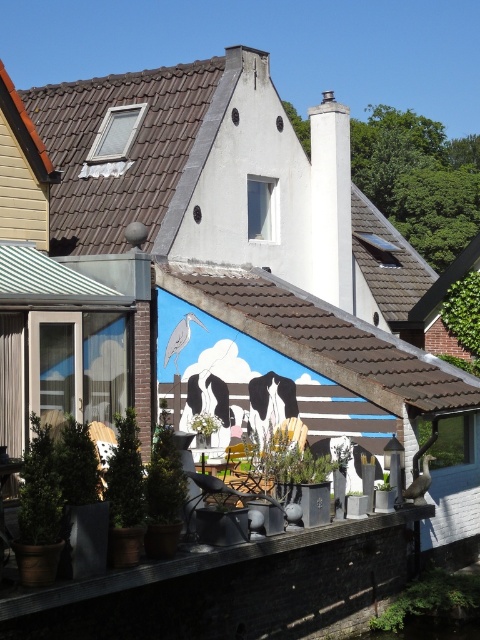
Question: Which is nearer to the green matte plant at center?

Choices:
 (A) green leafy plant at center
 (B) green leafy plant at lower right

Answer: (B)

Question: Does green leafy plant at lower right appear over green matte plant at center?

Choices:
 (A) no
 (B) yes

Answer: (A)

Question: Is green leafy plant at lower right positioned before green matte plant at center?

Choices:
 (A) yes
 (B) no

Answer: (B)

Question: Which point is closer to the camera?

Choices:
 (A) green matte plant at center
 (B) green leafy plant at lower right
 (C) green leafy plant at center

Answer: (A)

Question: Can you confirm if green leafy plant at center is smaller than green matte plant at center?

Choices:
 (A) yes
 (B) no

Answer: (B)

Question: Which point is closer to the camera taking this photo?

Choices:
 (A) (210, 436)
 (B) (384, 476)

Answer: (B)